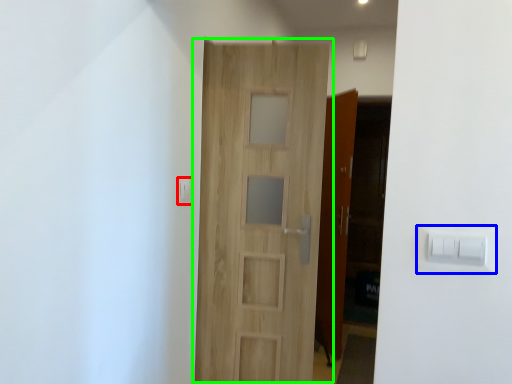
Question: Considering the real-world distances, which object is closest to light switch (highlighted by a red box)? light switch (highlighted by a blue box) or door (highlighted by a green box).

Choices:
 (A) light switch
 (B) door

Answer: (B)